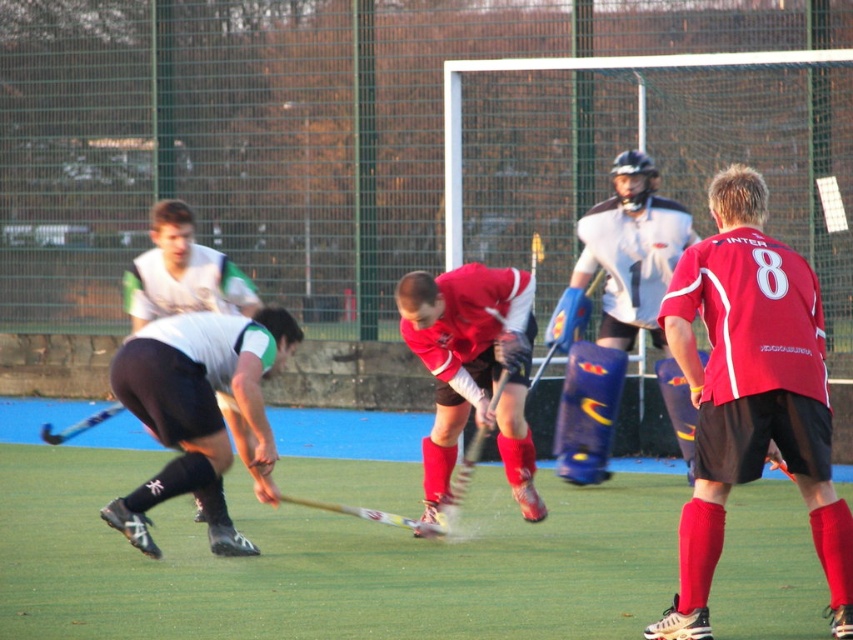
Question: Does matte red hockey stick at center have a smaller size compared to matte white jersey at center?

Choices:
 (A) yes
 (B) no

Answer: (A)

Question: Is matte red shorts at right further to the viewer compared to matte red hockey stick at center?

Choices:
 (A) no
 (B) yes

Answer: (A)

Question: Which point is farther to the camera?

Choices:
 (A) matte red hockey stick at center
 (B) green artificial turf at center
 (C) matte white shorts at left

Answer: (A)

Question: Does green artificial turf at center have a lesser width compared to matte red shorts at right?

Choices:
 (A) no
 (B) yes

Answer: (A)

Question: Which object is farther from the camera taking this photo?

Choices:
 (A) matte red hockey stick at center
 (B) green artificial turf at center
 (C) blue metallic hockey stick at lower left
 (D) matte white shorts at left

Answer: (C)

Question: Among these objects, which one is nearest to the camera?

Choices:
 (A) green artificial turf at center
 (B) matte red hockey stick at center

Answer: (A)